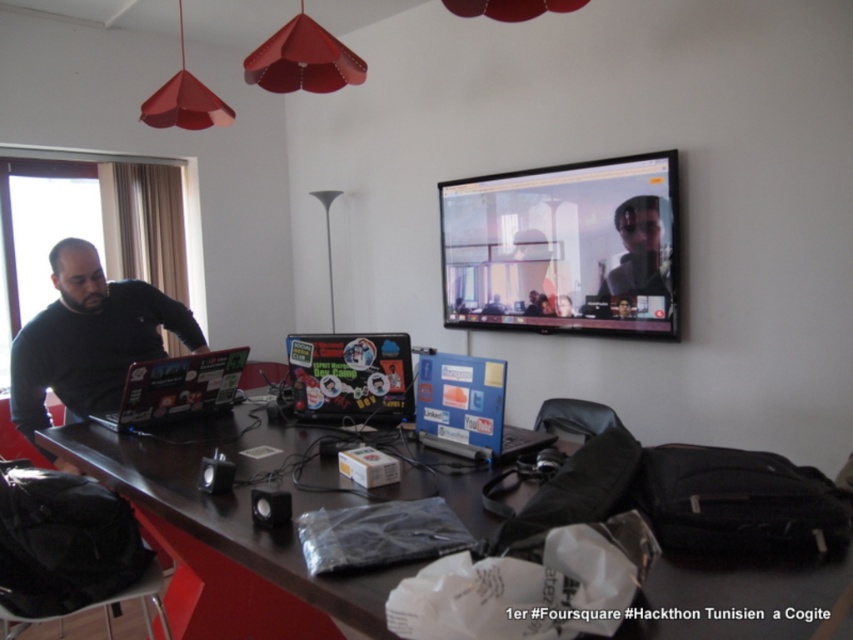
Question: From the image, what is the correct spatial relationship of black plastic computer desk at center in relation to black glossy monitor at upper center?

Choices:
 (A) left
 (B) right

Answer: (A)

Question: Which object is the closest to the black plastic computer desk at center?

Choices:
 (A) shiny black laptop at left
 (B) matte black shirt at upper center
 (C) stickered matte laptop at center

Answer: (A)

Question: Can you confirm if shiny black laptop at left is thinner than matte black shirt at upper center?

Choices:
 (A) no
 (B) yes

Answer: (A)

Question: Which object appears farthest from the camera in this image?

Choices:
 (A) black plastic computer desk at center
 (B) shiny black laptop at left
 (C) matte black shirt at upper center
 (D) black glossy monitor at upper center

Answer: (C)

Question: Considering the real-world distances, which object is closest to the black plastic computer desk at center?

Choices:
 (A) matte black laptop at left
 (B) matte black shirt at upper center
 (C) blue matte laptop at center
 (D) shiny black laptop at left

Answer: (D)

Question: Considering the relative positions of black glossy monitor at upper center and shiny black laptop at left in the image provided, where is black glossy monitor at upper center located with respect to shiny black laptop at left?

Choices:
 (A) left
 (B) right

Answer: (B)